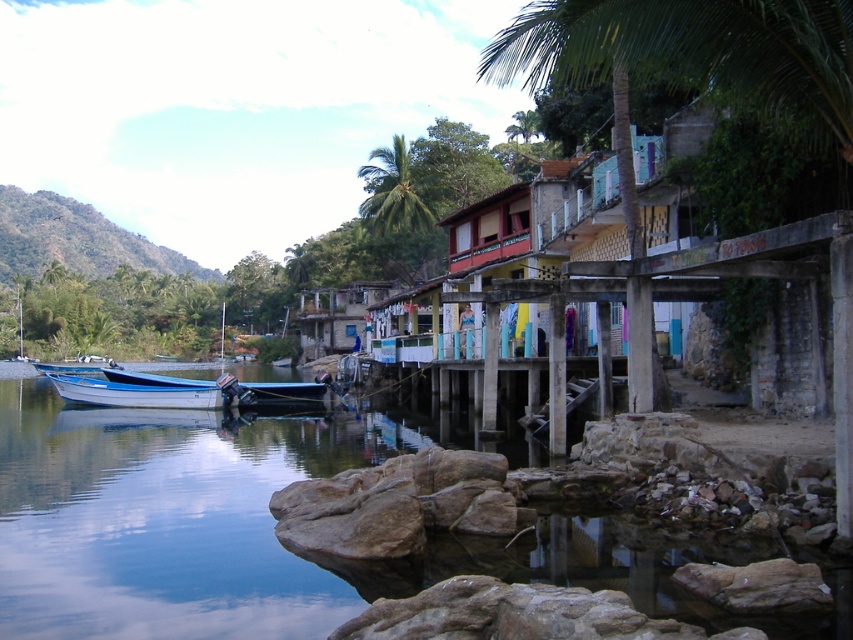
You are a tour guide leading a group near the riverside. You want to ensure safety by checking if the blue glossy water at lower left is within a safe distance from the white glossy boat at lower left. The safety regulation requires that the water must be at least 6 meters away from any boat. Is the current distance compliant with the safety rule?

The distance between the blue glossy water at lower left and the white glossy boat at lower left is 5.97 meters, which is slightly less than the required 6 meters. Therefore, it does not comply with the safety regulation.

You are planning to dock your boat in this riverside scene. You have two boats available, the white glossy boat at lower left and the blue matte boat at left. The distance between them is crucial for safe docking. Can you determine which boat is closer to the docking area?

The white glossy boat at lower left is 33.38 feet away from the blue matte boat at left. Since the question asks which is closer to the docking area, more information is needed about the docking area location. However, based on their positions, the white glossy boat at lower left is positioned at the lower left, suggesting it might be closer to the shore where docking occurs.

You are planning to build a new structure on the riverside. The rustic wooden hut at center and the blue matte boat at left are both in your way. Which one can you move to make more space for your construction project?

The rustic wooden hut at center has a smaller width than the blue matte boat at left, so moving the rustic wooden hut at center would free up more space for the construction project since it is narrower.